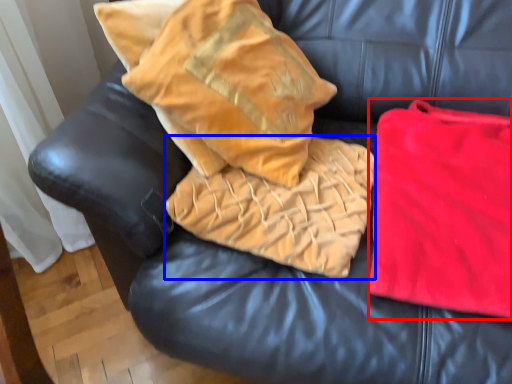
Question: Which object appears farthest to the camera in this image, material (highlighted by a red box) or cloth (highlighted by a blue box)?

Choices:
 (A) material
 (B) cloth

Answer: (B)